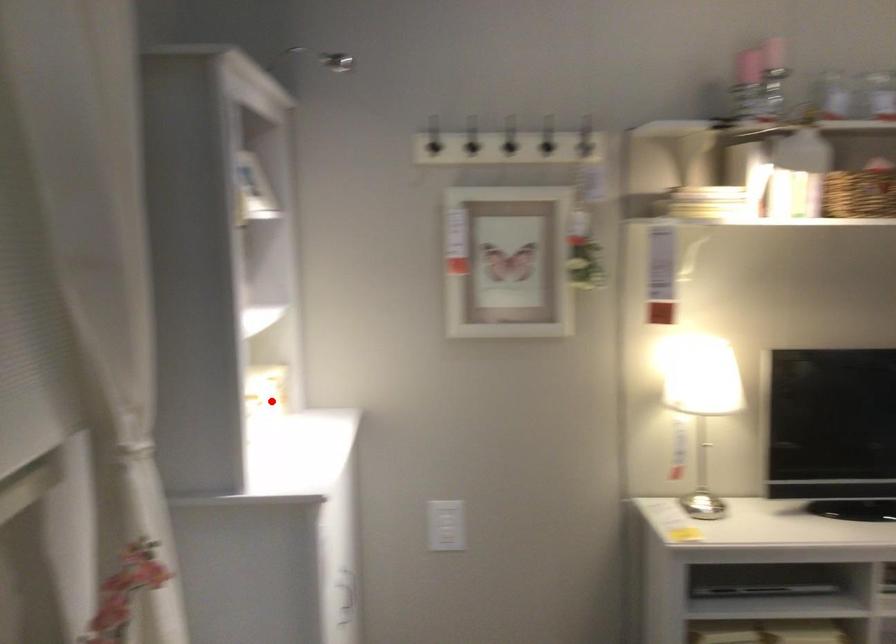
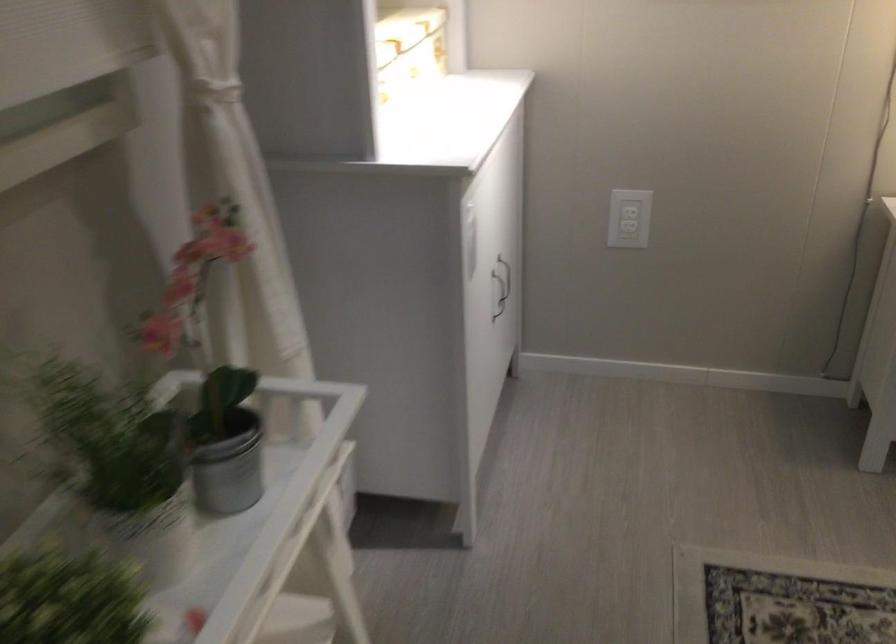
Question: A red point is marked in image1. In image2, is the corresponding 3D point closer to the camera or farther? Reply with the corresponding letter.

Choices:
 (A) The corresponding 3D point is closer.
 (B) The corresponding 3D point is farther.

Answer: (A)